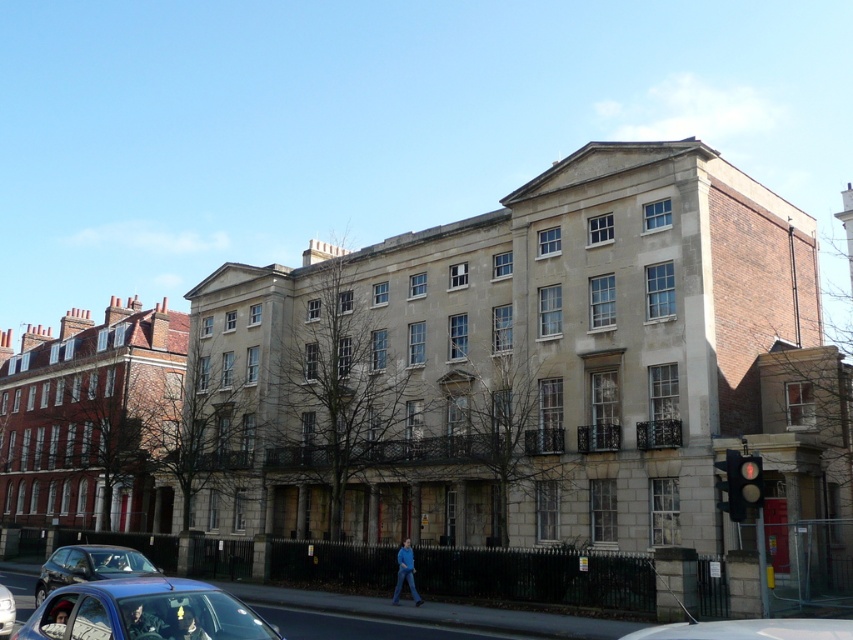
Question: Among these objects, which one is nearest to the camera?

Choices:
 (A) metallic silver car at lower left
 (B) silver metallic car at lower left

Answer: (B)

Question: Can you confirm if matte blue car at lower left is thinner than red glass traffic light at right?

Choices:
 (A) no
 (B) yes

Answer: (A)

Question: Can you confirm if metallic traffic light at right is thinner than red glass traffic light at right?

Choices:
 (A) yes
 (B) no

Answer: (B)

Question: Estimate the real-world distances between objects in this image. Which object is closer to the metallic silver car at center?

Choices:
 (A) metallic silver car at lower left
 (B) red glass traffic light at right

Answer: (B)

Question: Does matte blue car at lower left appear on the right side of red glass traffic light at right?

Choices:
 (A) yes
 (B) no

Answer: (B)

Question: Which point is closer to the camera?

Choices:
 (A) red glass traffic light at right
 (B) metallic traffic light at right
 (C) matte blue car at lower left
 (D) metallic silver car at center

Answer: (D)